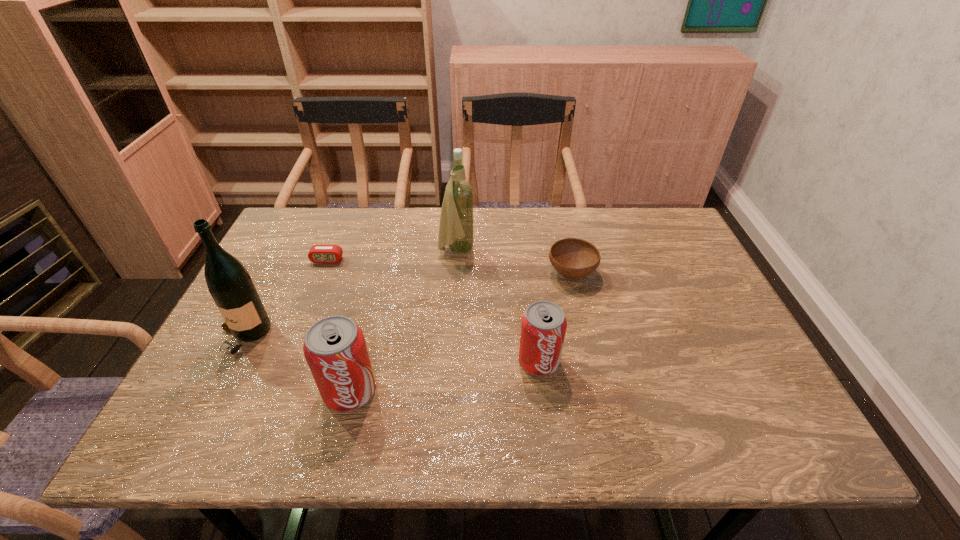
This screenshot has height=540, width=960. I want to click on free space that satisfies the following two spatial constraints: 1. on the front-facing side of the shortest object; 2. on the left side of the fourth object from right to left, so click(x=275, y=391).

Locate an element on the screen. Image resolution: width=960 pixels, height=540 pixels. vacant space that satisfies the following two spatial constraints: 1. on the front-facing side of the bowl; 2. on the right side of the farther wine bottle is located at coordinates (455, 273).

Locate an element on the screen. The width and height of the screenshot is (960, 540). free space that satisfies the following two spatial constraints: 1. on the front side of the nearer wine bottle; 2. on the left side of the fourth object from right to left is located at coordinates (216, 391).

At what (x,y) coordinates should I click in order to perform the action: click on vacant point that satisfies the following two spatial constraints: 1. on the front-facing side of the fourth object from left to right; 2. on the back side of the bowl. Please return your answer as a coordinate pair (x, y). This screenshot has width=960, height=540. Looking at the image, I should click on (455, 273).